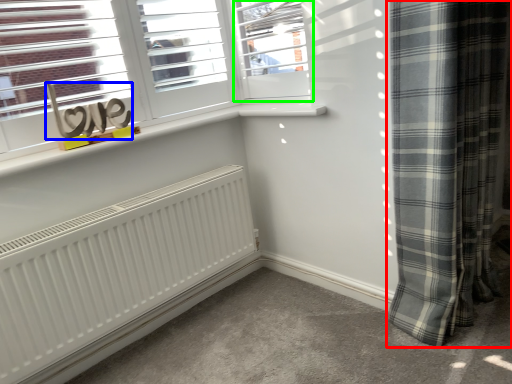
Question: Which object is the farthest from curtain (highlighted by a red box)? Choose among these: writing (highlighted by a blue box) or window (highlighted by a green box).

Choices:
 (A) writing
 (B) window

Answer: (A)